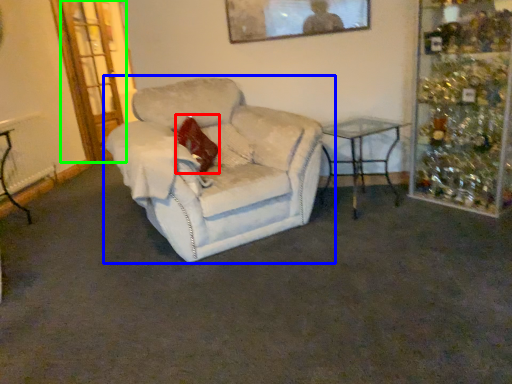
Question: Which object is positioned closest to pillow (highlighted by a red box)? Select from chair (highlighted by a blue box) and glass door (highlighted by a green box).

Choices:
 (A) chair
 (B) glass door

Answer: (A)